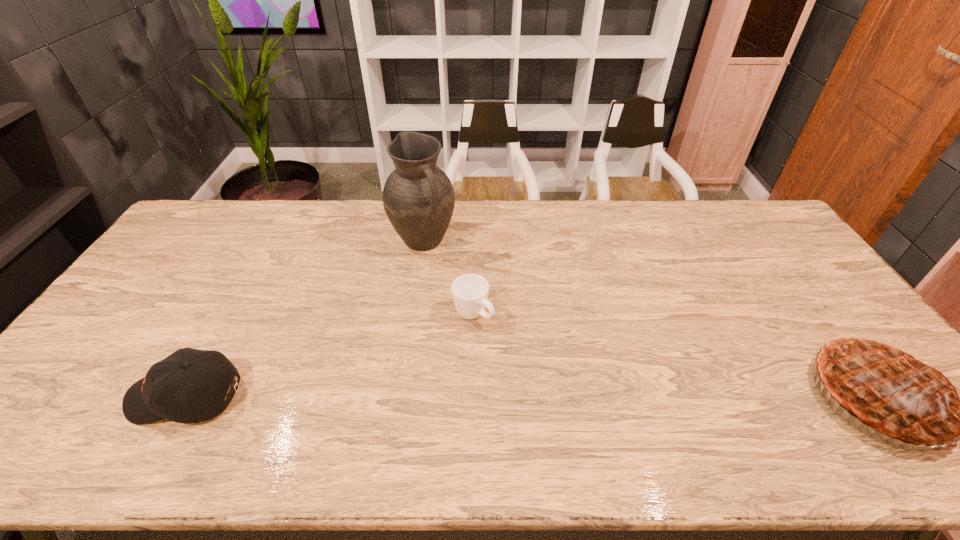
Find the location of `the third tallest object`. the third tallest object is located at coordinates (186, 374).

Identify the location of the leftmost object. (186, 374).

In order to click on the tallest object in this screenshot , I will do `click(418, 197)`.

Where is `the farthest object`? the farthest object is located at coordinates (418, 197).

Locate an element on the screen. The width and height of the screenshot is (960, 540). the third object from left to right is located at coordinates (470, 292).

The height and width of the screenshot is (540, 960). Identify the location of the second farthest object. (470, 292).

Find the location of a particular element. free space located 0.170m on the front-facing side of the baseball cap is located at coordinates (62, 397).

The width and height of the screenshot is (960, 540). Find the location of `free location located 0.170m on the front-facing side of the baseball cap`. free location located 0.170m on the front-facing side of the baseball cap is located at coordinates (62, 397).

This screenshot has height=540, width=960. Find the location of `free region located 0.340m on the side of the farthest object with the handle`. free region located 0.340m on the side of the farthest object with the handle is located at coordinates (491, 328).

Where is `vacant space situated 0.210m on the side of the farthest object with the handle`? This screenshot has width=960, height=540. vacant space situated 0.210m on the side of the farthest object with the handle is located at coordinates (468, 300).